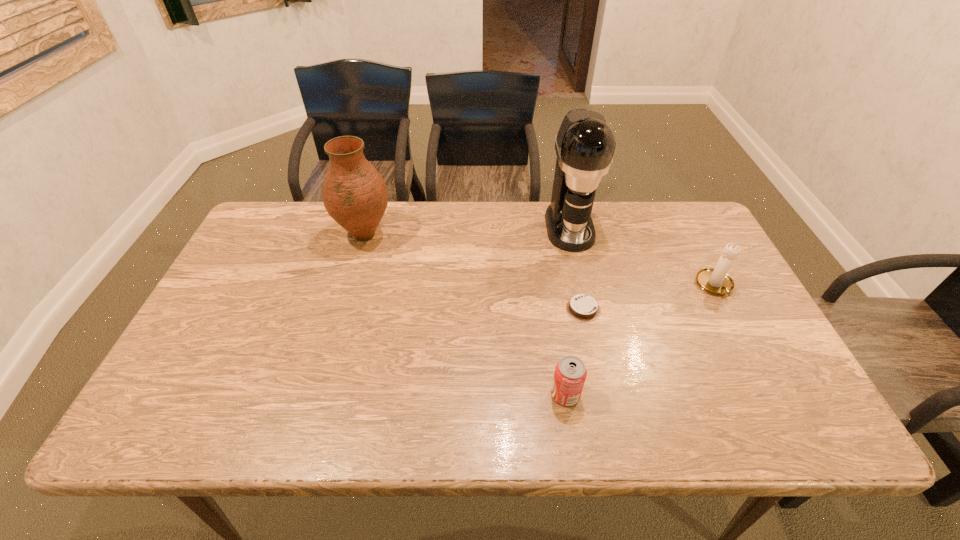
Locate an element on the screen. Image resolution: width=960 pixels, height=540 pixels. free space located 0.180m on the handle side of the third tallest object is located at coordinates (753, 359).

Where is `vacant region located 0.380m on the back of the nearest object`? Image resolution: width=960 pixels, height=540 pixels. vacant region located 0.380m on the back of the nearest object is located at coordinates (546, 267).

Where is `free space located 0.290m on the front of the shortest object`? This screenshot has height=540, width=960. free space located 0.290m on the front of the shortest object is located at coordinates (610, 430).

Locate an element on the screen. This screenshot has width=960, height=540. coffee maker that is at the far edge is located at coordinates (585, 144).

Where is `vase at the far edge`? This screenshot has width=960, height=540. vase at the far edge is located at coordinates (354, 194).

The image size is (960, 540). What are the coordinates of `object that is at the near edge` in the screenshot? It's located at (570, 374).

At what (x,y) coordinates should I click in order to perform the action: click on object positioned at the right edge. Please return your answer as a coordinate pair (x, y). The image size is (960, 540). Looking at the image, I should click on (716, 281).

Where is `blank space at the far edge`? This screenshot has height=540, width=960. blank space at the far edge is located at coordinates pyautogui.click(x=425, y=218).

Find the location of a particular element. vacant point at the near edge is located at coordinates (259, 434).

Locate an element on the screen. vacant region at the left edge of the desktop is located at coordinates (179, 387).